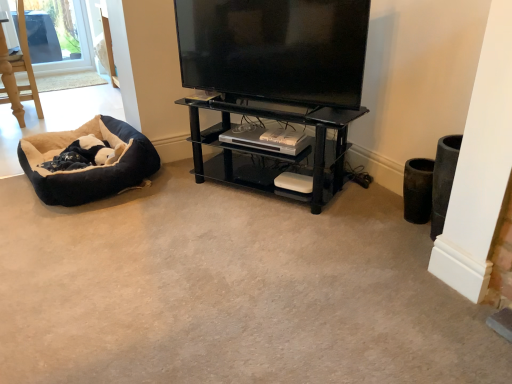
Question: Considering the relative positions of black glass shelf at center and black plush dog bed at lower left in the image provided, is black glass shelf at center to the left of black plush dog bed at lower left from the viewer's perspective?

Choices:
 (A) no
 (B) yes

Answer: (A)

Question: Is black glass shelf at center facing away from black plush dog bed at lower left?

Choices:
 (A) yes
 (B) no

Answer: (B)

Question: Is black glass shelf at center bigger than black plush dog bed at lower left?

Choices:
 (A) yes
 (B) no

Answer: (A)

Question: Is black glass shelf at center positioned before black plush dog bed at lower left?

Choices:
 (A) yes
 (B) no

Answer: (A)

Question: Is black glass shelf at center located outside black plush dog bed at lower left?

Choices:
 (A) no
 (B) yes

Answer: (B)

Question: In the image, is black glossy flat-screen tv at upper center on the left side or the right side of black glass shelf at center?

Choices:
 (A) right
 (B) left

Answer: (B)

Question: Considering the positions of black glossy flat-screen tv at upper center and black glass shelf at center in the image, is black glossy flat-screen tv at upper center wider or thinner than black glass shelf at center?

Choices:
 (A) thin
 (B) wide

Answer: (A)

Question: Does point (330, 57) appear closer or farther from the camera than point (198, 104)?

Choices:
 (A) closer
 (B) farther

Answer: (A)

Question: Considering the positions of black glossy flat-screen tv at upper center and black glass shelf at center in the image, is black glossy flat-screen tv at upper center taller or shorter than black glass shelf at center?

Choices:
 (A) short
 (B) tall

Answer: (A)

Question: Relative to soft plush dog bed at left, is black glossy flat-screen tv at upper center in front or behind?

Choices:
 (A) behind
 (B) front

Answer: (B)

Question: From the image's perspective, is black glossy flat-screen tv at upper center located above or below soft plush dog bed at left?

Choices:
 (A) above
 (B) below

Answer: (A)

Question: Is black glossy flat-screen tv at upper center situated inside soft plush dog bed at left or outside?

Choices:
 (A) inside
 (B) outside

Answer: (B)

Question: In the image, is black glossy flat-screen tv at upper center on the left side or the right side of soft plush dog bed at left?

Choices:
 (A) left
 (B) right

Answer: (B)

Question: From the image's perspective, is black glass shelf at center above or below black glossy flat-screen tv at upper center?

Choices:
 (A) above
 (B) below

Answer: (B)

Question: Relative to black glossy flat-screen tv at upper center, is black glass shelf at center in front or behind?

Choices:
 (A) front
 (B) behind

Answer: (B)